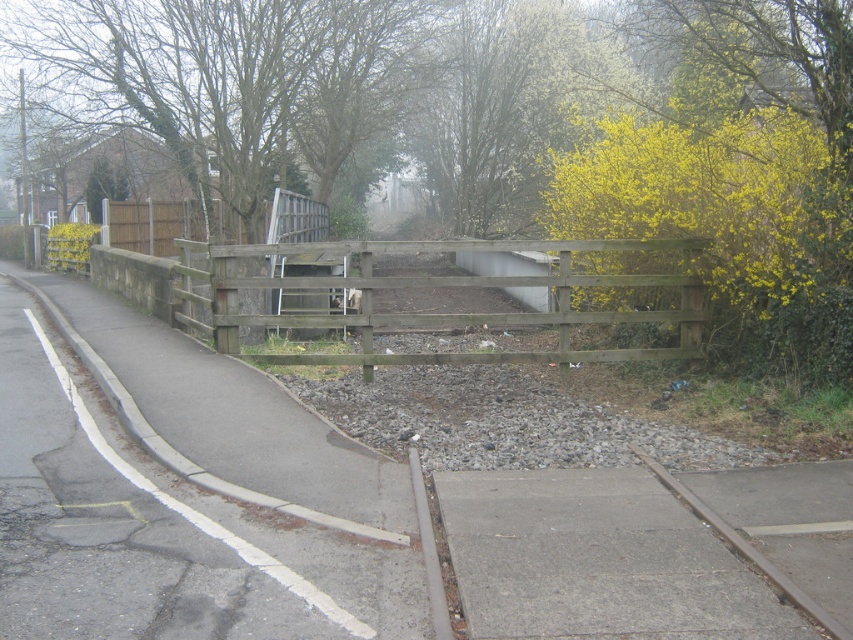
You are standing at the entrance of the railway crossing and want to walk to the gray concrete pavement at center. According to the coordinates provided, in which direction should you move from your current position?

The gray concrete pavement at center is located at coordinates point (596, 561). Since coordinates typically increase from the bottom left corner, moving towards the upper right direction would lead you to the gray concrete pavement at center.

You are standing at point A with coordinates point A at (566, 308). You want to walk to point B which is 10.60 meters away from you. Is there a clear path between you and point B? Please answer based on the scene description.

The path between point A at (566, 308) and point B is clear. There are no obstacles mentioned in the scene description that would block the path between them.

You are a delivery driver approaching the railway crossing and need to stop before the brown wooden fence at center and the brown wooden train track at lower right. According to safety regulations, vehicles must stop at least 15 meters away from train tracks. Can you safely proceed without violating the rule?

The distance between the brown wooden fence at center and the brown wooden train track at lower right is 7.83 meters. Since the required stopping distance is 15 meters, you are too close to the tracks and must not proceed further to comply with safety regulations.